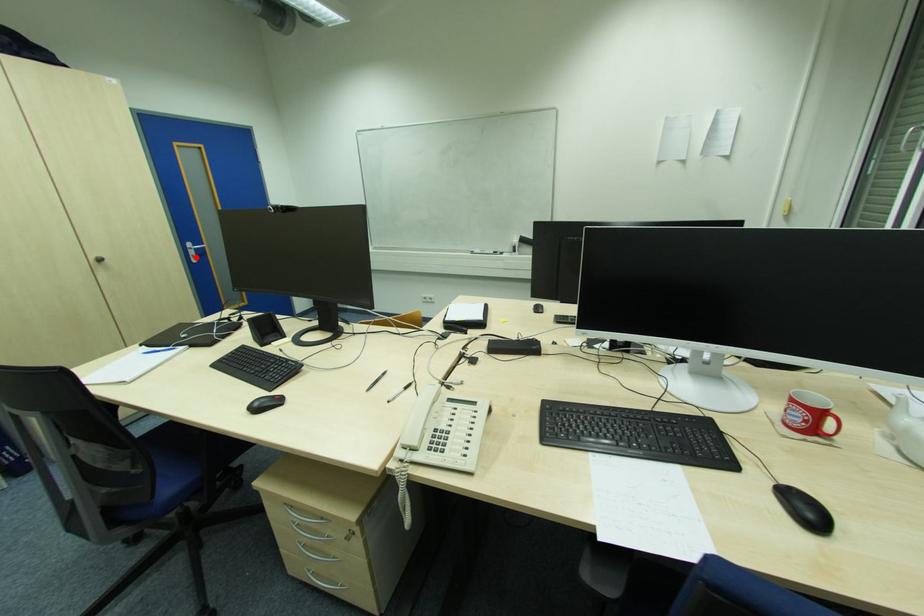
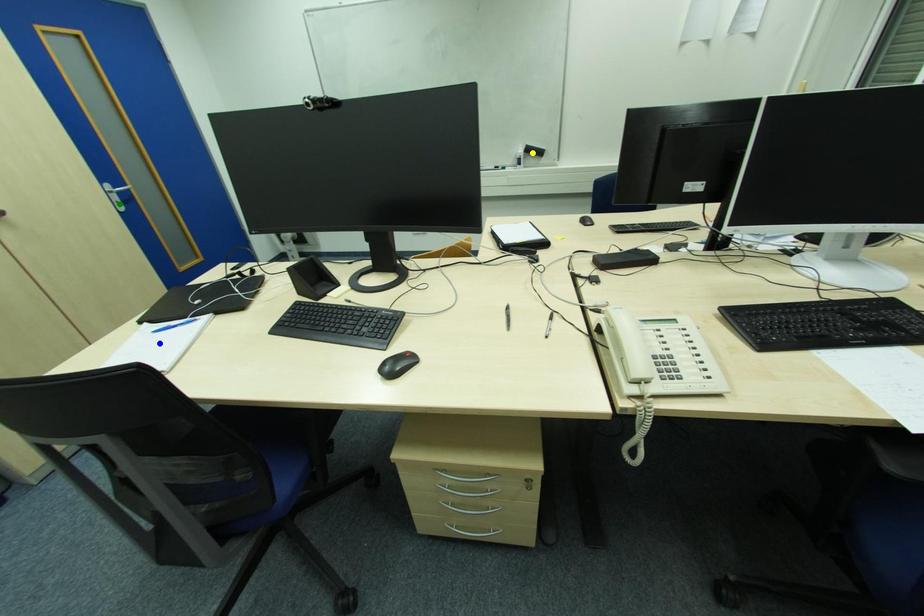
Question: I am providing you with two images of the same scene from different viewpoints. A red point is marked on the first image. You are given multiple points on the second image. In image 2, which mark is for the same physical point as the one in image 1?

Choices:
 (A) yellow point
 (B) blue point
 (C) green point

Answer: (C)